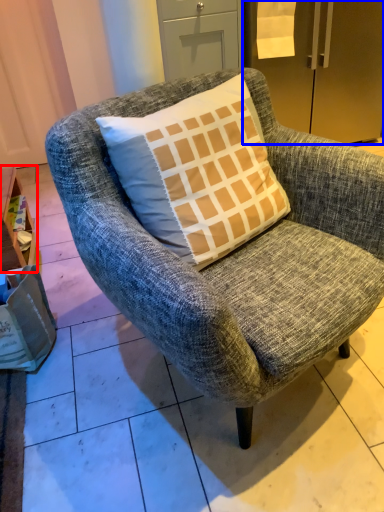
Question: Which point is further to the camera, table (highlighted by a red box) or refrigerator (highlighted by a blue box)?

Choices:
 (A) table
 (B) refrigerator

Answer: (B)